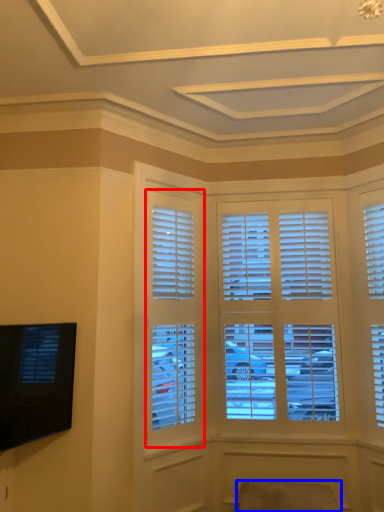
Question: Which object appears farthest to the camera in this image, window (highlighted by a red box) or swivel chair (highlighted by a blue box)?

Choices:
 (A) window
 (B) swivel chair

Answer: (A)